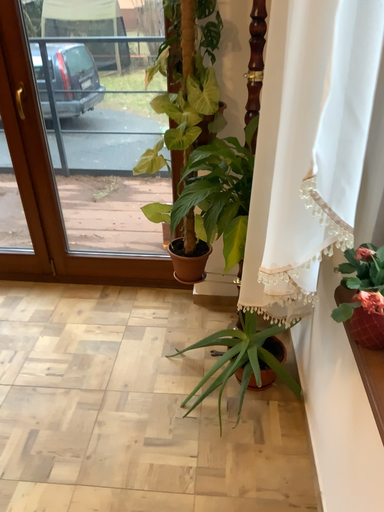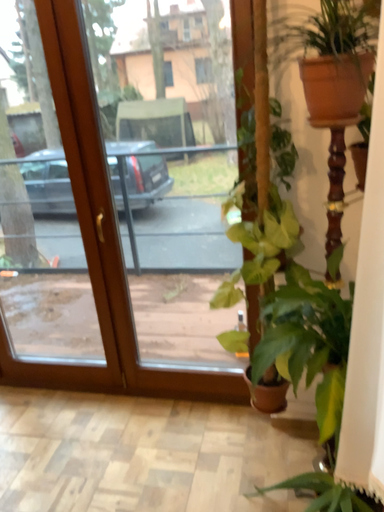
Question: How did the camera likely rotate when shooting the video?

Choices:
 (A) rotated downward
 (B) rotated upward

Answer: (B)